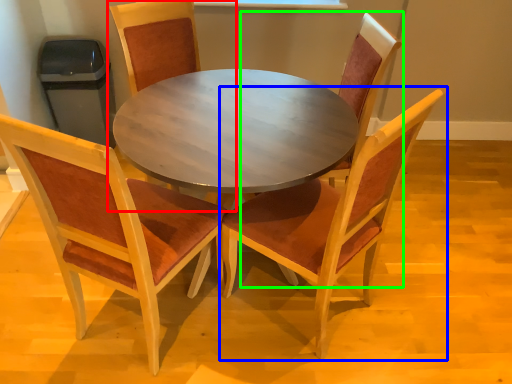
Question: Considering the real-world distances, which object is farthest from chair (highlighted by a red box)? chair (highlighted by a blue box) or chair (highlighted by a green box)?

Choices:
 (A) chair
 (B) chair

Answer: (A)